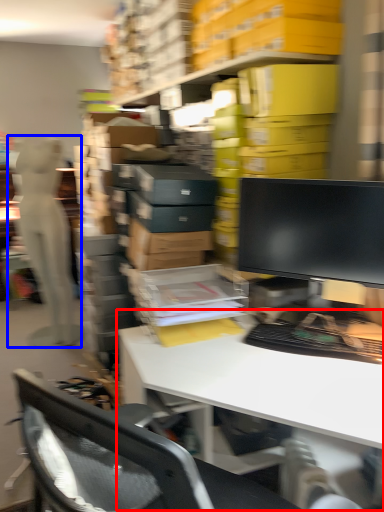
Question: Which of the following is the closest to the observer, desk (highlighted by a red box) or person (highlighted by a blue box)?

Choices:
 (A) desk
 (B) person

Answer: (A)